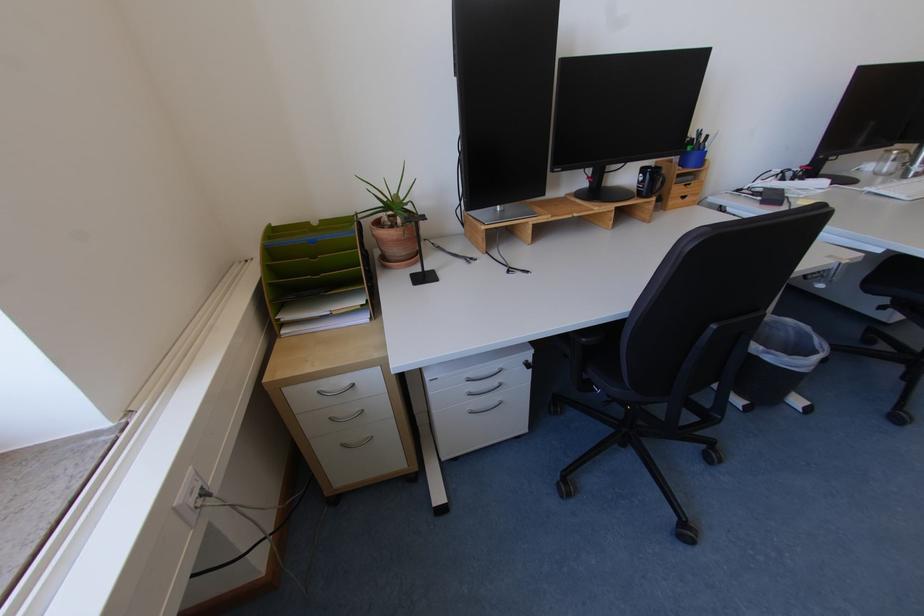
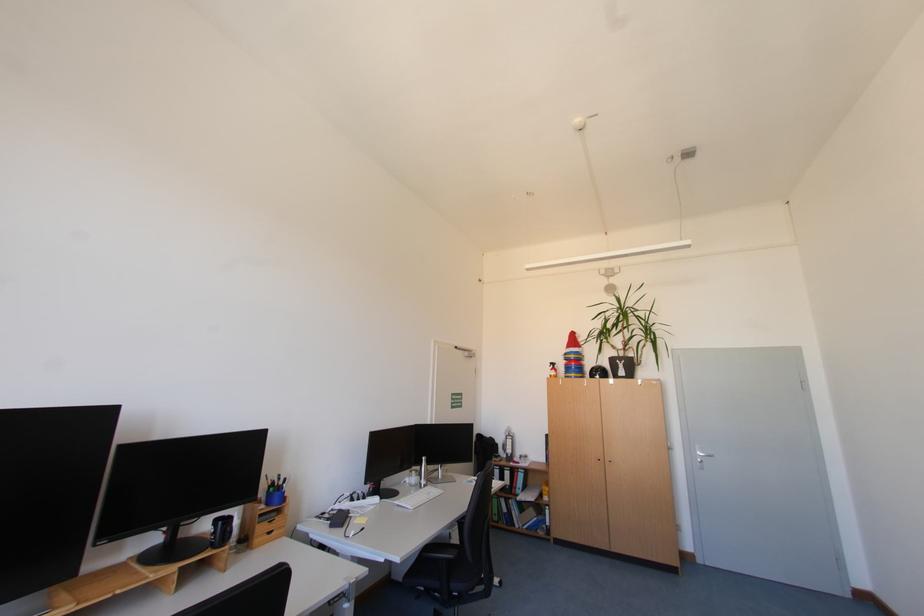
The first image is from the beginning of the video and the second image is from the end. How did the camera likely rotate when shooting the video?

The camera's rotation is toward right-up.